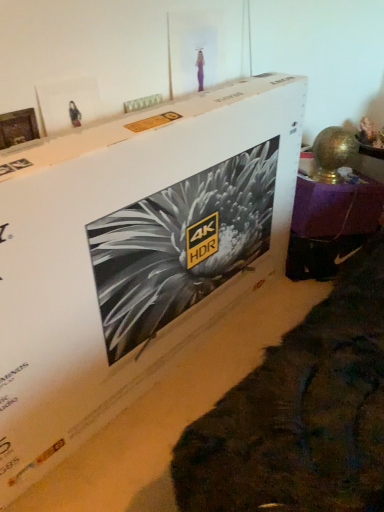
Question: Is wooden photo frame at upper left directly adjacent to metallic gold lamp at right?

Choices:
 (A) yes
 (B) no

Answer: (B)

Question: Does wooden photo frame at upper left have a smaller size compared to metallic gold lamp at right?

Choices:
 (A) yes
 (B) no

Answer: (A)

Question: Is wooden photo frame at upper left looking in the opposite direction of metallic gold lamp at right?

Choices:
 (A) no
 (B) yes

Answer: (A)

Question: Does wooden photo frame at upper left appear on the right side of metallic gold lamp at right?

Choices:
 (A) no
 (B) yes

Answer: (A)

Question: Are wooden photo frame at upper left and metallic gold lamp at right located far from each other?

Choices:
 (A) no
 (B) yes

Answer: (B)

Question: From the image's perspective, relative to white cardboard box at center, is metallic gold lamp at right above or below?

Choices:
 (A) below
 (B) above

Answer: (B)

Question: Is metallic gold lamp at right taller or shorter than white cardboard box at center?

Choices:
 (A) short
 (B) tall

Answer: (A)

Question: Is point (322, 240) closer or farther from the camera than point (269, 217)?

Choices:
 (A) farther
 (B) closer

Answer: (A)

Question: Would you say metallic gold lamp at right is to the left or to the right of white cardboard box at center in the picture?

Choices:
 (A) right
 (B) left

Answer: (A)

Question: In terms of size, does wooden photo frame at upper left appear bigger or smaller than metallic gold lamp at right?

Choices:
 (A) small
 (B) big

Answer: (A)

Question: From the image's perspective, relative to metallic gold lamp at right, is wooden photo frame at upper left above or below?

Choices:
 (A) above
 (B) below

Answer: (A)

Question: In terms of height, does wooden photo frame at upper left look taller or shorter compared to metallic gold lamp at right?

Choices:
 (A) tall
 (B) short

Answer: (B)

Question: In terms of width, does wooden photo frame at upper left look wider or thinner when compared to metallic gold lamp at right?

Choices:
 (A) wide
 (B) thin

Answer: (B)

Question: Is wooden photo frame at upper left wider or thinner than white cardboard box at center?

Choices:
 (A) thin
 (B) wide

Answer: (A)

Question: Considering their positions, is wooden photo frame at upper left located in front of or behind white cardboard box at center?

Choices:
 (A) behind
 (B) front

Answer: (A)